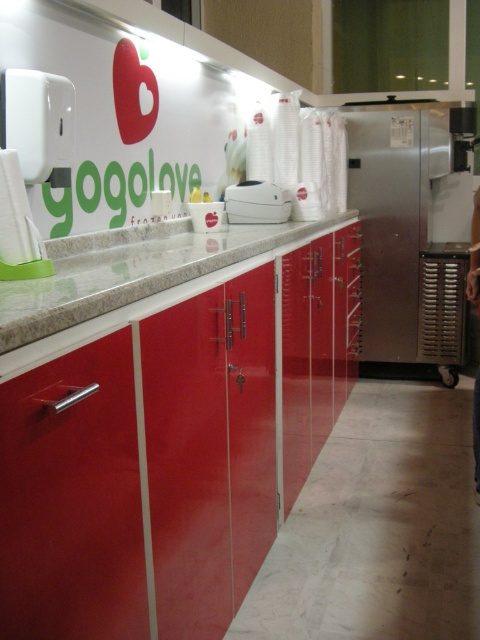
Question: Does granite countertop at center appear under white plastic toaster at center?

Choices:
 (A) yes
 (B) no

Answer: (A)

Question: Is stainless steel refrigerator at right wider than white plastic toaster at center?

Choices:
 (A) no
 (B) yes

Answer: (B)

Question: Which of the following is the farthest from the observer?

Choices:
 (A) white plastic toaster at center
 (B) stainless steel refrigerator at right
 (C) granite countertop at center

Answer: (B)

Question: Which point appears farthest from the camera in this image?

Choices:
 (A) (252, 182)
 (B) (151, 228)

Answer: (A)

Question: Which object appears closest to the camera in this image?

Choices:
 (A) granite countertop at center
 (B) white plastic toaster at center
 (C) stainless steel refrigerator at right

Answer: (A)

Question: Where is stainless steel refrigerator at right located in relation to granite countertop at center in the image?

Choices:
 (A) left
 (B) right

Answer: (B)